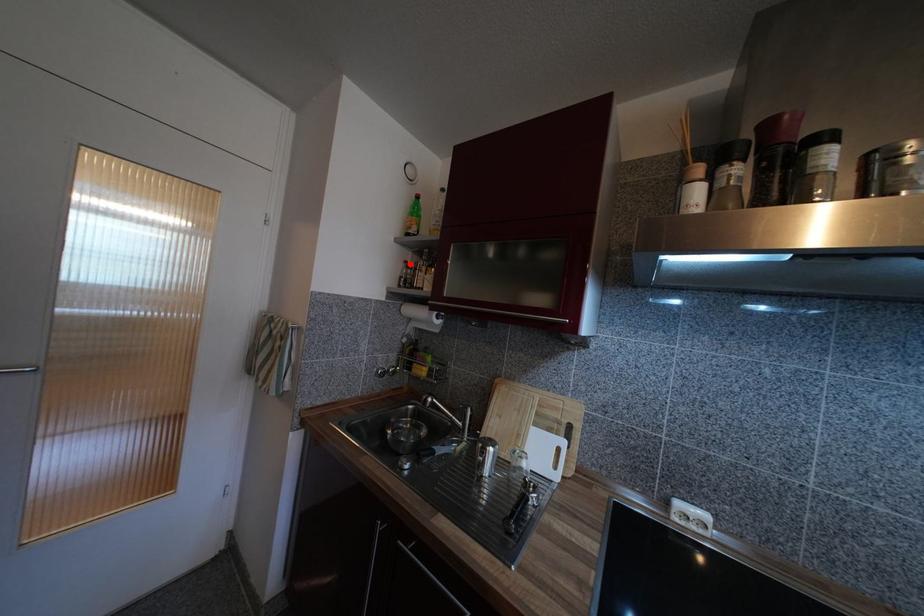
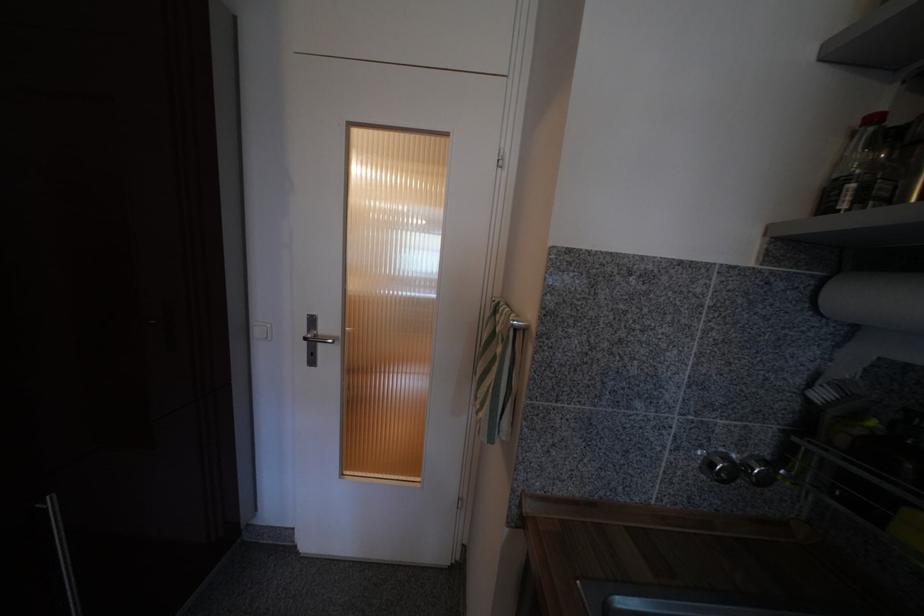
Question: I am providing you with two images of the same scene from different viewpoints. A red point is marked on the first image. Is the red point's position out of view in image 2?

Choices:
 (A) Yes
 (B) No

Answer: (B)